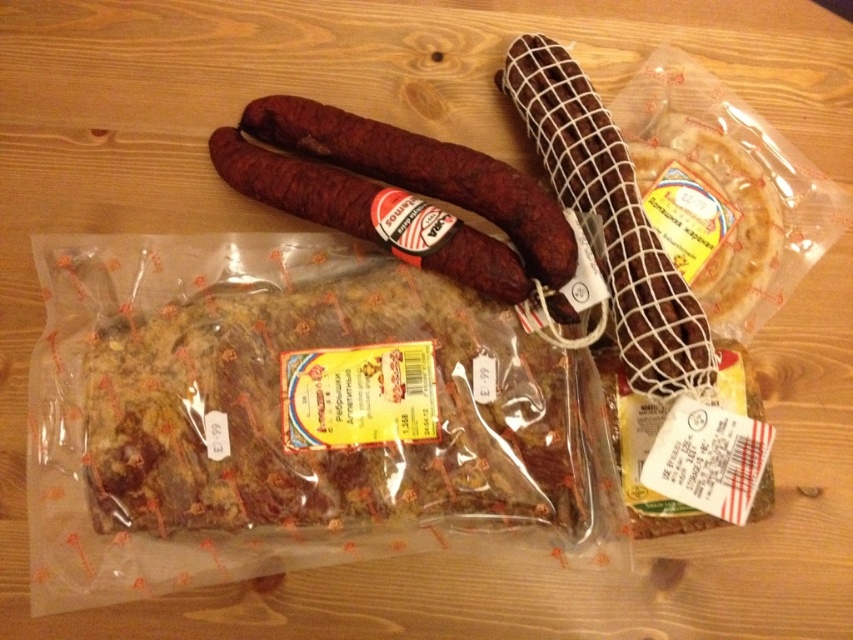
Is the position of dark brown netted sausage at upper right less distant than that of dark red textured sausage at center?

Yes, it is in front of dark red textured sausage at center.

Which is more to the left, dark brown netted sausage at upper right or dark red textured sausage at center?

dark red textured sausage at center is more to the left.

This screenshot has height=640, width=853. Describe the element at coordinates (610, 218) in the screenshot. I see `dark brown netted sausage at upper right` at that location.

This screenshot has height=640, width=853. Identify the location of dark brown netted sausage at upper right. (610, 218).